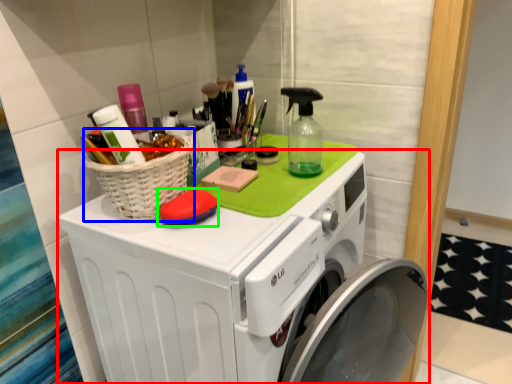
Question: Which object is positioned closest to washing machine (highlighted by a red box)? Select from basket (highlighted by a blue box) and soap (highlighted by a green box).

Choices:
 (A) basket
 (B) soap

Answer: (A)